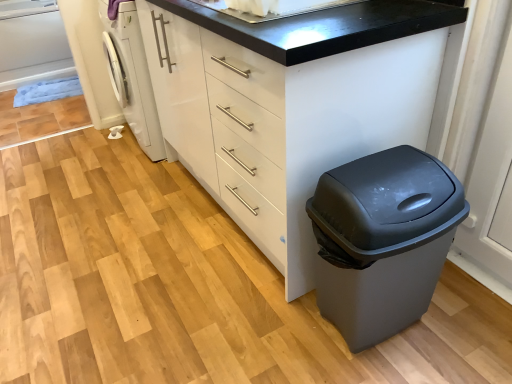
Identify the location of vacant region to the left of matte gray plastic trash can at lower right. This screenshot has width=512, height=384. (278, 329).